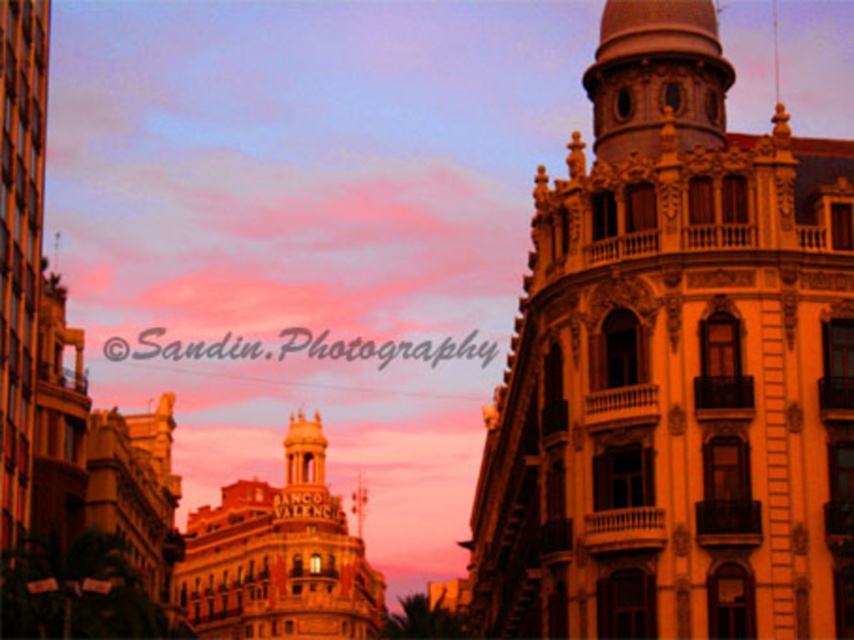
You are a city planner assessing the space between two historic buildings in the image. The golden stone tower at center and the gold textured building at center are both landmarks. If you need to install a temporary walkway between them for an event, and the walkway requires a minimum of 50 meters of space, will the current distance suffice?

The distance between the golden stone tower at center and the gold textured building at center is 48.79 meters, which is less than the required 50 meters. Therefore, the current distance does not suffice for the temporary walkway.

You are standing in the city square and want to take a photo of the golden stone tower at center. Based on its position in the image, where should you aim your camera to capture it?

The golden stone tower at center is located at the coordinates point (674, 365), so you should aim your camera towards that point to capture it.